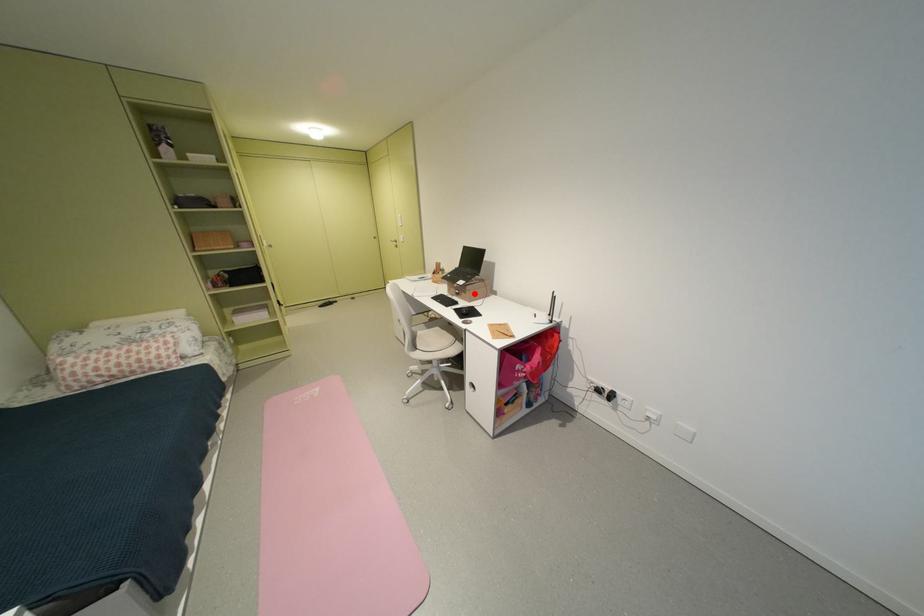
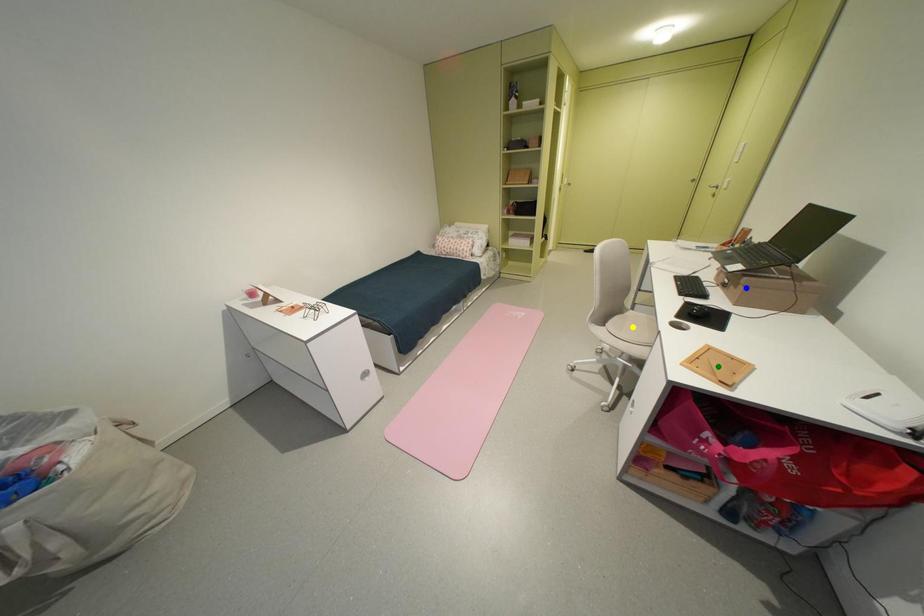
Question: I am providing you with two images of the same scene from different viewpoints. A red point is marked on the first image. You are given multiple points on the second image. Which mark in image 2 goes with the point in image 1?

Choices:
 (A) blue point
 (B) green point
 (C) yellow point

Answer: (A)